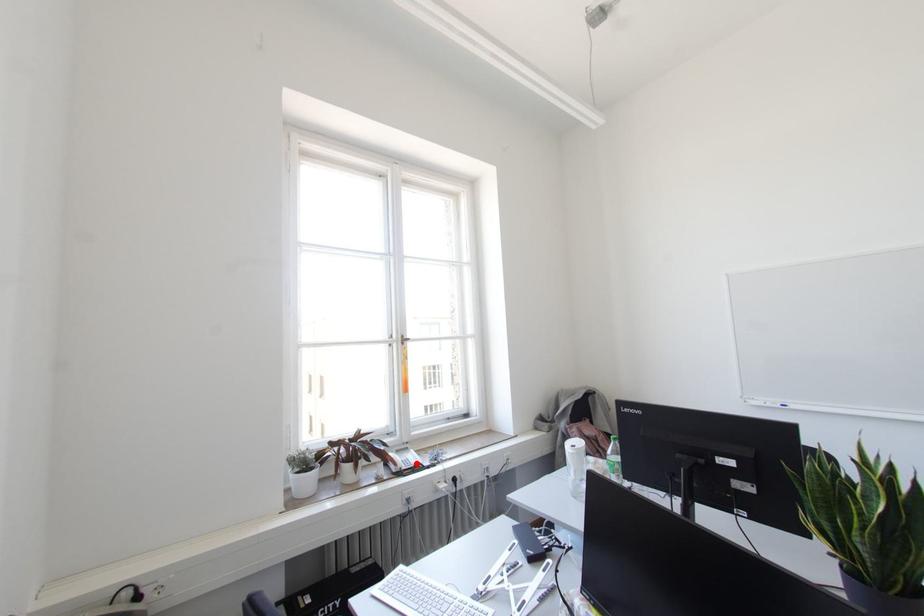
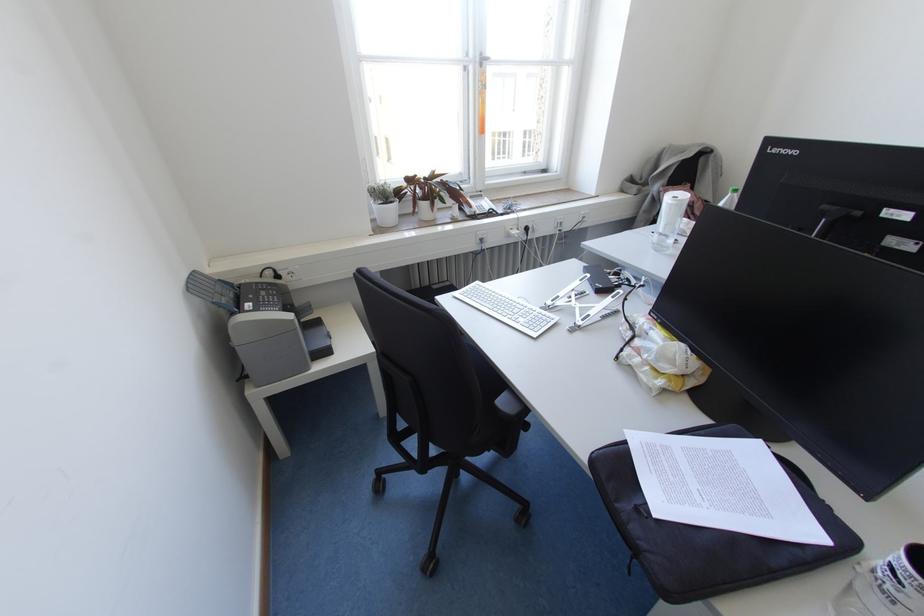
The point at the highlighted location is marked in the first image. Where is the corresponding point in the second image?

(490, 209)